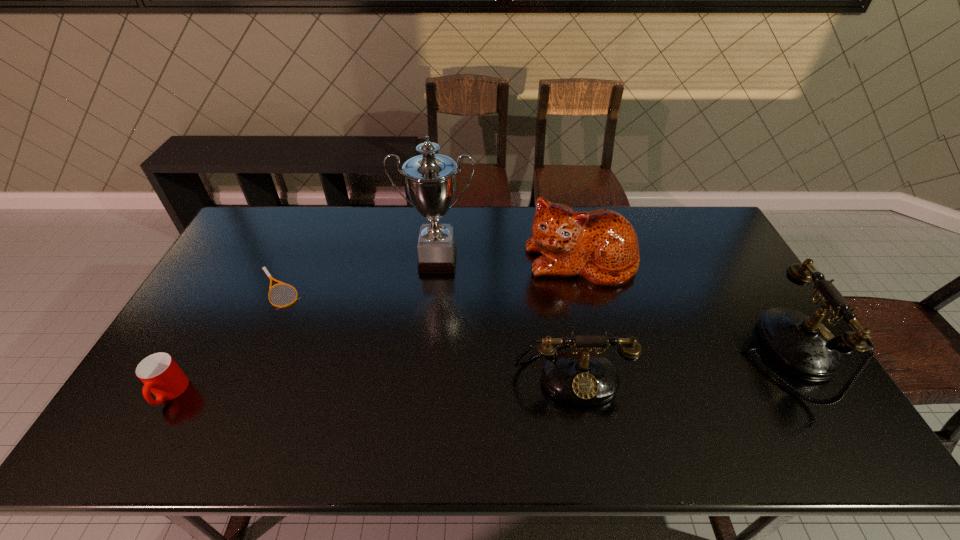
Where is `object at the near left corner`? The image size is (960, 540). object at the near left corner is located at coordinates (161, 375).

The image size is (960, 540). Identify the location of object positioned at the near right corner. (800, 344).

In the image, there is a desktop. Where is `vacant region at the far edge`? vacant region at the far edge is located at coordinates (491, 211).

The height and width of the screenshot is (540, 960). In the image, there is a desktop. In order to click on free space at the near edge in this screenshot , I will do `click(499, 409)`.

Where is `free space at the left edge of the desktop`? Image resolution: width=960 pixels, height=540 pixels. free space at the left edge of the desktop is located at coordinates (203, 308).

Where is `vacant space at the right edge`? The width and height of the screenshot is (960, 540). vacant space at the right edge is located at coordinates (723, 277).

The image size is (960, 540). Find the location of `free space at the far left corner of the desktop`. free space at the far left corner of the desktop is located at coordinates (x=266, y=211).

Where is `free space between the cat and the cup`? The height and width of the screenshot is (540, 960). free space between the cat and the cup is located at coordinates tap(375, 327).

The width and height of the screenshot is (960, 540). What are the coordinates of `vacant area between the second object from left to right and the trophy cup` in the screenshot? It's located at (358, 275).

Identify the location of vacant area between the cat and the leftmost object. (375, 327).